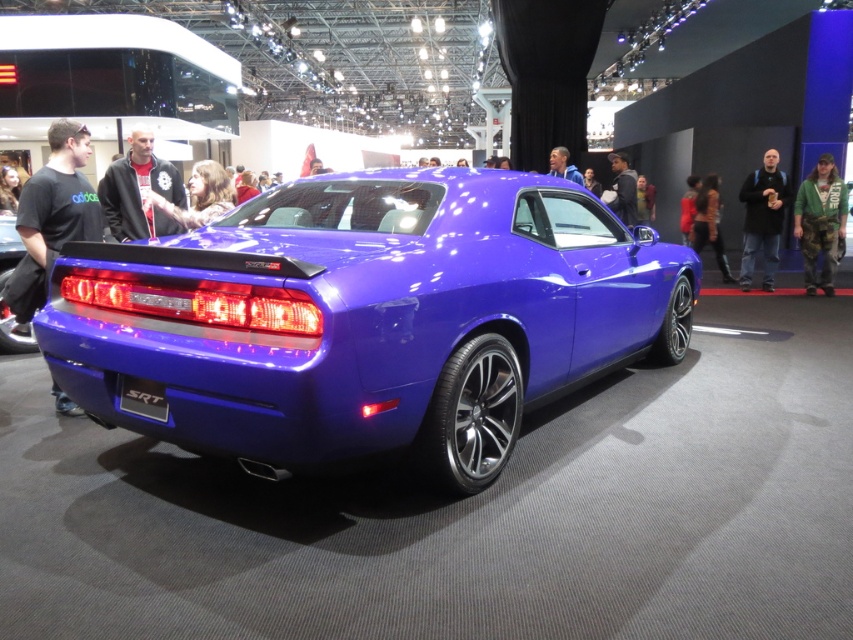
You are a photographer at the auto show and want to capture both the red fabric jacket at center and the blue metallic car at center in a single frame. Given that your camera has a fixed focal length, which object should you position closer to the camera to ensure both fit within the frame?

Since the red fabric jacket at center is narrower than the blue metallic car at center, you should position the red fabric jacket at center closer to the camera. This way, its smaller size will appear larger in the frame, balancing the proportions with the car and ensuring both fit within the shot.

You are a photographer standing at the entrance of the auto show. You want to take a photo of the blue metallic car at center while ensuring the red fabric jacket at center is visible in the background. Given that your camera has a maximum focus range of 10 feet, will you be able to capture both objects clearly in the same shot?

The red fabric jacket at center is 9.75 feet from blue metallic car at center. Since the camera can focus up to 10 feet, the distance between them is within the range. Therefore, both the blue metallic car at center and the red fabric jacket at center should be in focus.